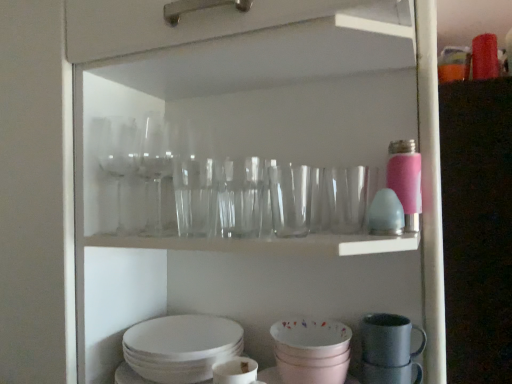
Question: Does white matte mug at lower center, the 4th tableware from the right, have a smaller size compared to matte pink bowl at lower center, which ranks as the third tableware in right-to-left order?

Choices:
 (A) no
 (B) yes

Answer: (B)

Question: Would you say matte pink bowl at lower center, which ranks as the third tableware in right-to-left order, is part of white matte mug at lower center, the 4th tableware from the right,'s contents?

Choices:
 (A) yes
 (B) no

Answer: (B)

Question: Considering the relative sizes of white matte mug at lower center, the first tableware in the left-to-right sequence, and matte pink bowl at lower center, marked as the second tableware in a left-to-right arrangement, in the image provided, is white matte mug at lower center, the first tableware in the left-to-right sequence, thinner than matte pink bowl at lower center, marked as the second tableware in a left-to-right arrangement,?

Choices:
 (A) no
 (B) yes

Answer: (B)

Question: From a real-world perspective, is white matte mug at lower center, the 4th tableware from the right, located higher than matte pink bowl at lower center, which ranks as the third tableware in right-to-left order?

Choices:
 (A) no
 (B) yes

Answer: (A)

Question: Is white matte mug at lower center, the first tableware in the left-to-right sequence, wider than matte pink bowl at lower center, marked as the second tableware in a left-to-right arrangement?

Choices:
 (A) no
 (B) yes

Answer: (A)

Question: From a real-world perspective, is white matte mug at lower center, the first tableware in the left-to-right sequence, beneath matte pink bowl at lower center, which ranks as the third tableware in right-to-left order?

Choices:
 (A) yes
 (B) no

Answer: (A)

Question: Does matte gray mug at lower right, which is counted as the fourth tableware, starting from the left, have a lesser width compared to matte gray mug at lower right, placed as the third tableware when sorted from left to right?

Choices:
 (A) no
 (B) yes

Answer: (B)

Question: From the image's perspective, is matte gray mug at lower right, acting as the first tableware starting from the right, under matte gray mug at lower right, placed as the third tableware when sorted from left to right?

Choices:
 (A) yes
 (B) no

Answer: (A)

Question: Does matte gray mug at lower right, which is counted as the fourth tableware, starting from the left, have a greater width compared to matte gray mug at lower right, marked as the 2th tableware in a right-to-left arrangement?

Choices:
 (A) yes
 (B) no

Answer: (B)

Question: Considering the relative positions of matte gray mug at lower right, which is counted as the fourth tableware, starting from the left, and matte gray mug at lower right, marked as the 2th tableware in a right-to-left arrangement, in the image provided, is matte gray mug at lower right, which is counted as the fourth tableware, starting from the left, to the left of matte gray mug at lower right, marked as the 2th tableware in a right-to-left arrangement, from the viewer's perspective?

Choices:
 (A) yes
 (B) no

Answer: (B)

Question: Does matte gray mug at lower right, which is counted as the fourth tableware, starting from the left, have a smaller size compared to matte gray mug at lower right, marked as the 2th tableware in a right-to-left arrangement?

Choices:
 (A) no
 (B) yes

Answer: (B)

Question: From a real-world perspective, does matte gray mug at lower right, which is counted as the fourth tableware, starting from the left, stand above matte gray mug at lower right, placed as the third tableware when sorted from left to right?

Choices:
 (A) yes
 (B) no

Answer: (B)

Question: From the image's perspective, would you say white matte mug at lower center, the 4th tableware from the right, is positioned over matte gray mug at lower right, placed as the third tableware when sorted from left to right?

Choices:
 (A) no
 (B) yes

Answer: (A)